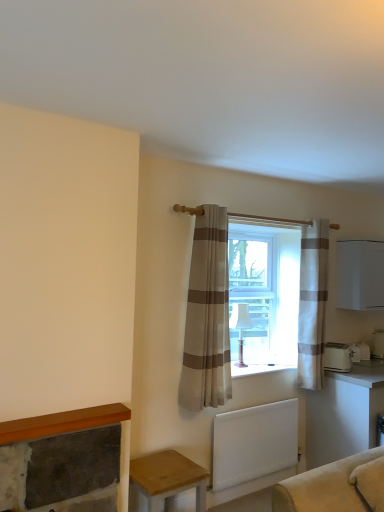
Question: Does white glossy table at lower right, which is the 1th table in back-to-front order, have a smaller size compared to beige striped curtain at center, arranged as the first curtain when viewed from the front?

Choices:
 (A) no
 (B) yes

Answer: (A)

Question: Is white glossy table at lower right, the second table from the left, to the right of beige striped curtain at center, arranged as the first curtain when viewed from the front, from the viewer's perspective?

Choices:
 (A) yes
 (B) no

Answer: (A)

Question: From a real-world perspective, is white glossy table at lower right, which is the 1th table in back-to-front order, over beige striped curtain at center, which is the second curtain in back-to-front order?

Choices:
 (A) no
 (B) yes

Answer: (A)

Question: From the image's perspective, does white glossy table at lower right, the second table from the left, appear higher than beige striped curtain at center, which is the second curtain in back-to-front order?

Choices:
 (A) yes
 (B) no

Answer: (B)

Question: Can you confirm if white glossy table at lower right, the first table from the right, is bigger than beige striped curtain at center, placed as the first curtain when sorted from left to right?

Choices:
 (A) yes
 (B) no

Answer: (A)

Question: Relative to beige striped curtain at center, which is the second curtain in back-to-front order, is white fabric lampshade at window in front or behind?

Choices:
 (A) behind
 (B) front

Answer: (A)

Question: From the image's perspective, relative to beige striped curtain at center, placed as the 2th curtain when sorted from right to left, is white fabric lampshade at window above or below?

Choices:
 (A) above
 (B) below

Answer: (B)

Question: Is point (243, 315) closer or farther from the camera than point (223, 221)?

Choices:
 (A) farther
 (B) closer

Answer: (A)

Question: Would you say white fabric lampshade at window is inside or outside beige striped curtain at center, placed as the 2th curtain when sorted from right to left?

Choices:
 (A) outside
 (B) inside

Answer: (A)

Question: Based on their positions, is white plastic toaster at lower right, which ranks as the 1th appliance in front-to-back order, located to the left or right of white striped curtain at center, the 2th curtain in the left-to-right sequence?

Choices:
 (A) right
 (B) left

Answer: (A)

Question: In terms of width, does white plastic toaster at lower right, the 2th appliance in the back-to-front sequence, look wider or thinner when compared to white striped curtain at center, the 1th curtain in the right-to-left sequence?

Choices:
 (A) thin
 (B) wide

Answer: (B)

Question: From the image's perspective, is white plastic toaster at lower right, which is counted as the 1th appliance, starting from the left, positioned above or below white striped curtain at center, positioned as the first curtain in back-to-front order?

Choices:
 (A) below
 (B) above

Answer: (A)

Question: Considering the positions of white plastic toaster at lower right, the 2th appliance in the back-to-front sequence, and white striped curtain at center, the 2th curtain in the left-to-right sequence, in the image, is white plastic toaster at lower right, the 2th appliance in the back-to-front sequence, bigger or smaller than white striped curtain at center, the 2th curtain in the left-to-right sequence,?

Choices:
 (A) big
 (B) small

Answer: (B)

Question: Is white fabric lampshade at window bigger or smaller than wooden table at lower left, arranged as the second table when viewed from the back?

Choices:
 (A) big
 (B) small

Answer: (B)

Question: In terms of width, does white fabric lampshade at window look wider or thinner when compared to wooden table at lower left, which is the first table in front-to-back order?

Choices:
 (A) wide
 (B) thin

Answer: (B)